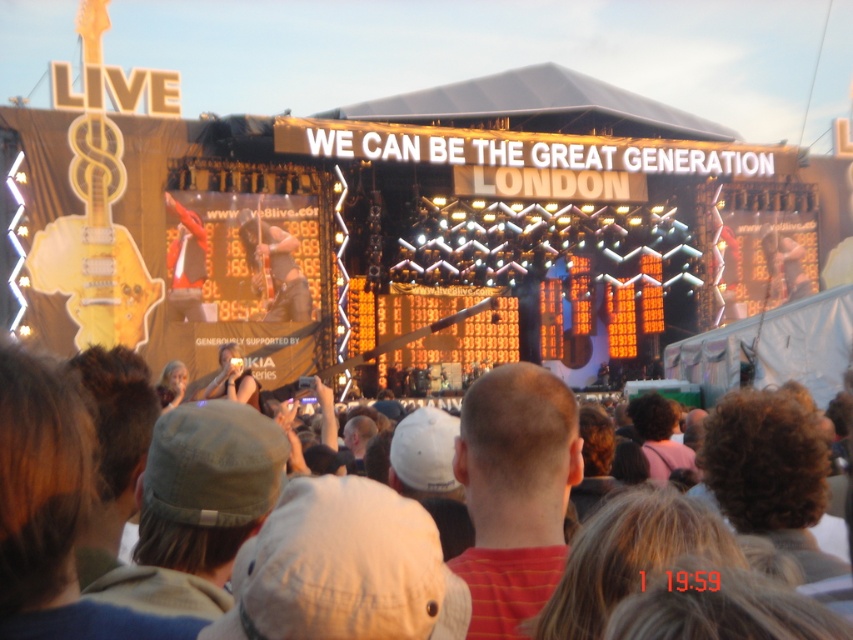
Is point (503, 387) positioned in front of point (109, 260)?

Yes.

Can you confirm if red striped shirt at center is positioned to the right of yellow matte guitar at upper left?

Yes, red striped shirt at center is to the right of yellow matte guitar at upper left.

Which is in front, point (473, 460) or point (115, 128)?

Positioned in front is point (473, 460).

In order to click on red striped shirt at center in this screenshot , I will do `click(514, 492)`.

Who is higher up, white cotton hat at center or yellow matte guitar at upper left?

Positioned higher is yellow matte guitar at upper left.

Does white cotton hat at center have a smaller size compared to yellow matte guitar at upper left?

Yes, white cotton hat at center is smaller than yellow matte guitar at upper left.

You are a GUI agent. You are given a task and a screenshot of the screen. Output one action in this format:
    pyautogui.click(x=<x>, y=<y>)
    Task: Click on the white cotton hat at center
    
    Given the screenshot: What is the action you would take?
    pyautogui.click(x=53, y=509)

Where is `white cotton hat at center`? white cotton hat at center is located at coordinates (53, 509).

From the picture: Does white cotton hat at center have a larger size compared to red striped shirt at center?

Correct, white cotton hat at center is larger in size than red striped shirt at center.

Who is lower down, white cotton hat at center or red striped shirt at center?

red striped shirt at center is lower down.

Image resolution: width=853 pixels, height=640 pixels. What do you see at coordinates (53, 509) in the screenshot?
I see `white cotton hat at center` at bounding box center [53, 509].

Locate an element on the screen. The height and width of the screenshot is (640, 853). white cotton hat at center is located at coordinates (53, 509).